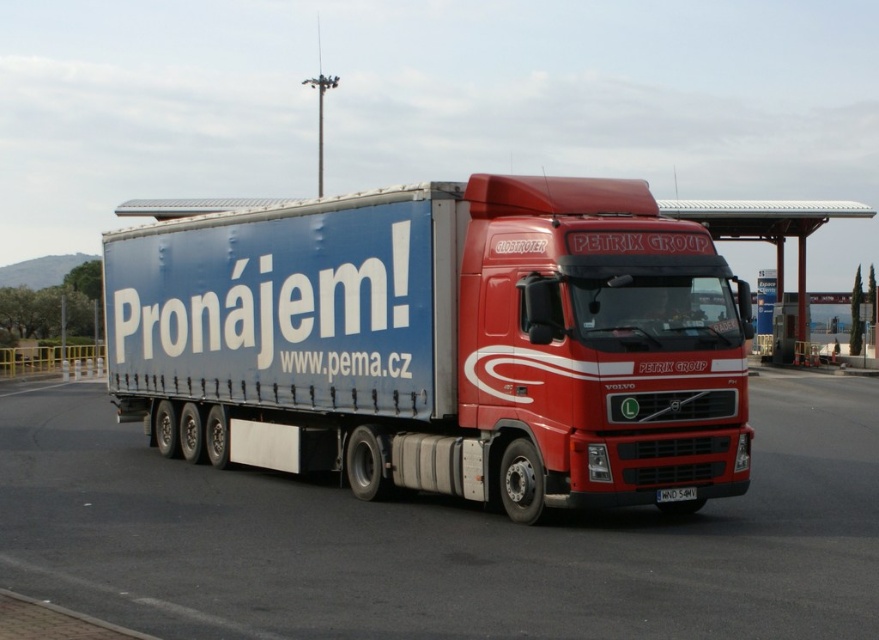
Question: Which object appears closest to the camera in this image?

Choices:
 (A) white plastic license plate at bottom center
 (B) red matte truck at center

Answer: (B)

Question: Which object is positioned farthest from the red matte truck at center?

Choices:
 (A) matte blue trailer at center
 (B) white plastic license plate at bottom center

Answer: (B)

Question: Can you confirm if matte blue trailer at center is positioned to the right of red matte truck at center?

Choices:
 (A) yes
 (B) no

Answer: (B)

Question: Which point appears farthest from the camera in this image?

Choices:
 (A) (563, 612)
 (B) (665, 497)

Answer: (B)

Question: Considering the relative positions of red matte truck at center and white plastic license plate at bottom center in the image provided, where is red matte truck at center located with respect to white plastic license plate at bottom center?

Choices:
 (A) above
 (B) below

Answer: (B)

Question: Does red matte truck at center appear under white plastic license plate at bottom center?

Choices:
 (A) no
 (B) yes

Answer: (B)